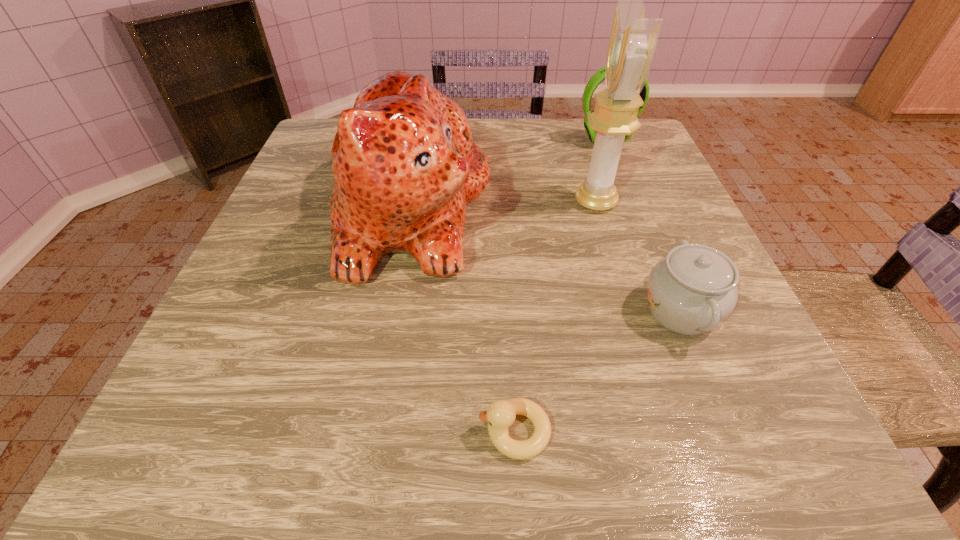
I want to click on headset at the right edge, so click(x=599, y=76).

At what (x,y) coordinates should I click in order to perform the action: click on chinaware that is positioned at the right edge. Please return your answer as a coordinate pair (x, y). The image size is (960, 540). Looking at the image, I should click on (692, 290).

The image size is (960, 540). I want to click on object that is at the far left corner, so click(x=405, y=166).

I want to click on object present at the far right corner, so click(599, 76).

Find the location of a particular element. The image size is (960, 540). vacant position at the far edge of the desktop is located at coordinates (575, 161).

Identify the location of vacant space at the near edge. Image resolution: width=960 pixels, height=540 pixels. (532, 428).

This screenshot has width=960, height=540. I want to click on free space at the left edge of the desktop, so click(329, 187).

Image resolution: width=960 pixels, height=540 pixels. In order to click on vacant space at the right edge of the desktop in this screenshot , I will do `click(638, 259)`.

The image size is (960, 540). I want to click on vacant area that lies between the nearest object and the tallest object, so click(x=555, y=316).

Locate an element on the screen. free space between the chinaware and the third shortest object is located at coordinates (643, 226).